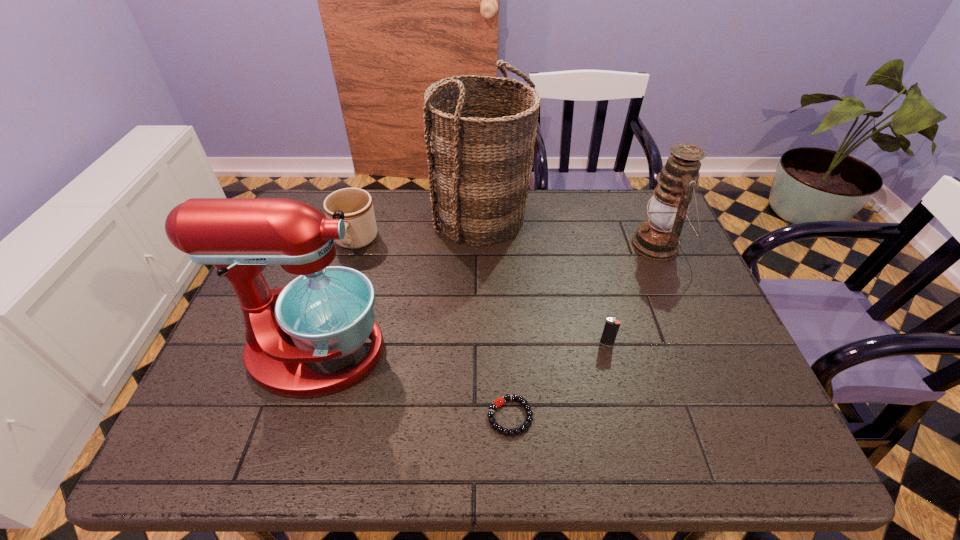
Find the location of a particular element. The height and width of the screenshot is (540, 960). basket is located at coordinates (480, 148).

Find the location of `mixer`. mixer is located at coordinates (x=326, y=313).

The image size is (960, 540). What are the coordinates of `lantern` in the screenshot? It's located at (658, 238).

At what (x,y) coordinates should I click in order to perform the action: click on the third tallest object. Please return your answer as a coordinate pair (x, y). This screenshot has height=540, width=960. Looking at the image, I should click on (658, 238).

Identify the location of mug. (360, 224).

Find the location of a particular element. The height and width of the screenshot is (540, 960). igniter is located at coordinates point(611,327).

The image size is (960, 540). I want to click on the second object from right to left, so click(x=611, y=327).

Where is `the shortest object`? This screenshot has width=960, height=540. the shortest object is located at coordinates (511, 432).

This screenshot has height=540, width=960. Find the location of `blank space located 0.050m on the front of the basket`. blank space located 0.050m on the front of the basket is located at coordinates (481, 261).

This screenshot has height=540, width=960. I want to click on vacant point located on the front-facing side of the mixer, so click(538, 351).